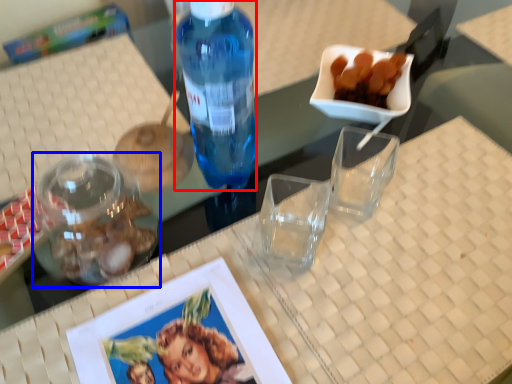
Question: Which point is closer to the camera, bottle (highlighted by a red box) or tableware (highlighted by a blue box)?

Choices:
 (A) bottle
 (B) tableware

Answer: (A)